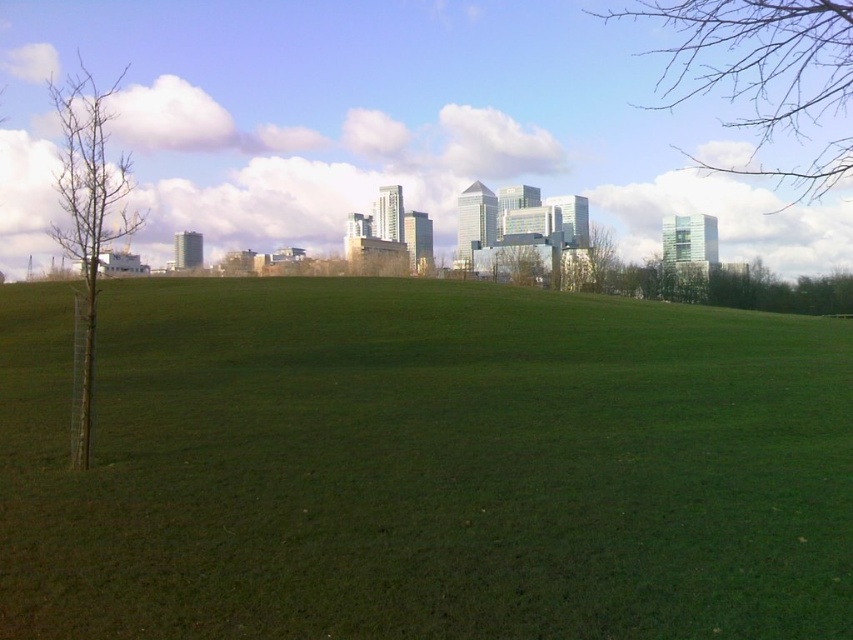
Is green grass at center wider than green leafy tree at center?

Correct, the width of green grass at center exceeds that of green leafy tree at center.

In order to click on green grass at center in this screenshot , I will do tap(422, 465).

Between point (105, 353) and point (492, 276), which one is positioned in front?

Point (105, 353)

The width and height of the screenshot is (853, 640). Find the location of `green grass at center`. green grass at center is located at coordinates (422, 465).

Image resolution: width=853 pixels, height=640 pixels. Describe the element at coordinates (422, 465) in the screenshot. I see `green grass at center` at that location.

Consider the image. Which is more to the right, green grass at center or bare branches at upper right?

bare branches at upper right

The image size is (853, 640). What do you see at coordinates (422, 465) in the screenshot?
I see `green grass at center` at bounding box center [422, 465].

Where is `green grass at center`? The height and width of the screenshot is (640, 853). green grass at center is located at coordinates 422,465.

Does bare branches at upper right have a lesser height compared to bare wood tree at left?

In fact, bare branches at upper right may be taller than bare wood tree at left.

I want to click on bare branches at upper right, so [x=756, y=58].